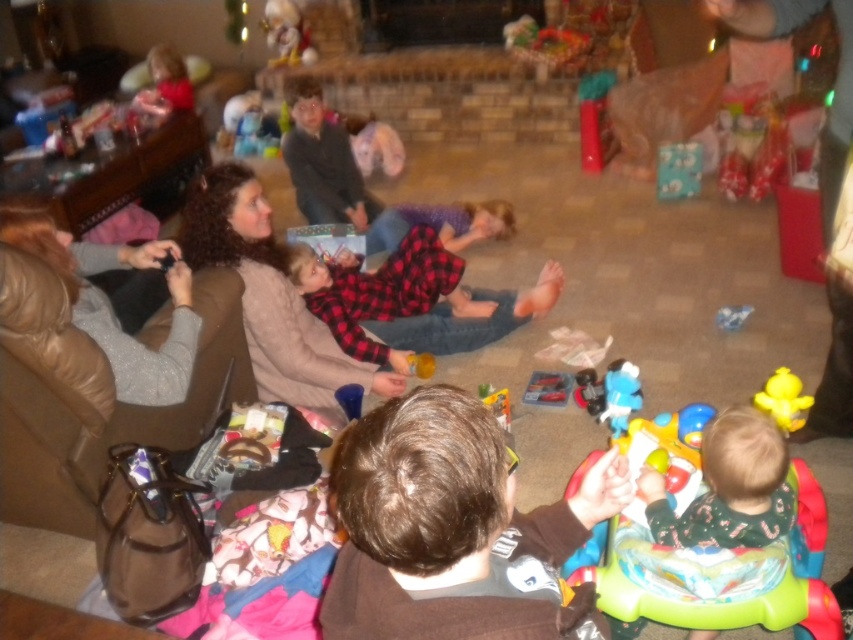
Looking at this image, you are standing in the living room and see the point marked at coordinates (287, 35). What object is located at that point?

The point at coordinates (287, 35) corresponds to the fluffy white teddy bear at upper center.

You are a parent at the Christmas gathering and want to give your child a toy. You have two options in the image, the plush teddy bear at upper center and the blue plush toy at center. Which one is larger in size?

The plush teddy bear at upper center is bigger than the blue plush toy at center, so the plush teddy bear at upper center is the larger one.